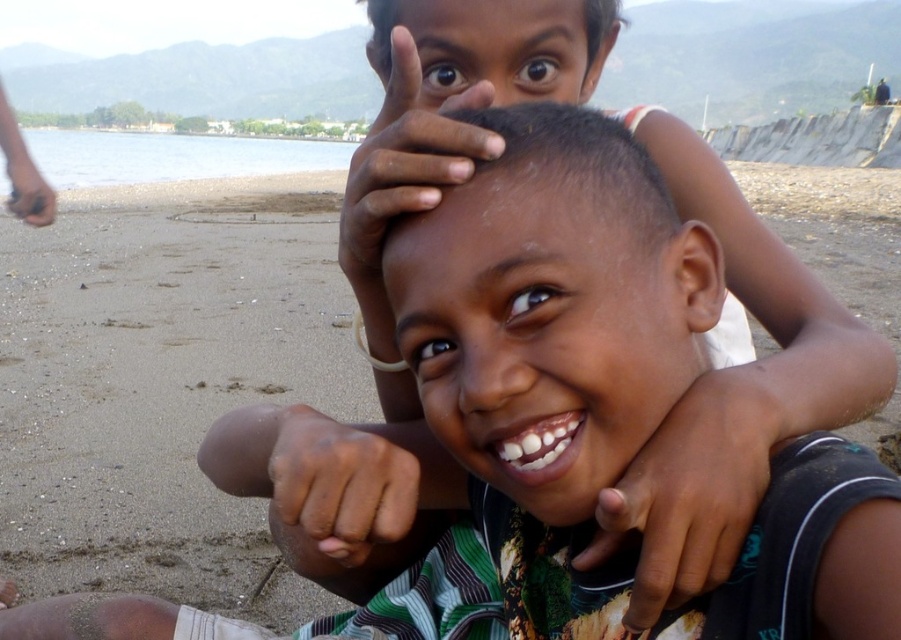
You are a photographer trying to capture the two children in the scene. You notice the dark skin hand at center and the dry skin at upper center. Which object is wider?

The dark skin hand at center is less wide than the dry skin at upper center, so the dry skin at upper center is wider.

You are a lifeguard standing at the beach and you need to reach the dark skin hand at center and the brown skin hand at lower left. Which hand is closer to you?

The dark skin hand at center is closer to you than the brown skin hand at lower left because the distance between them is 1.09 meters.